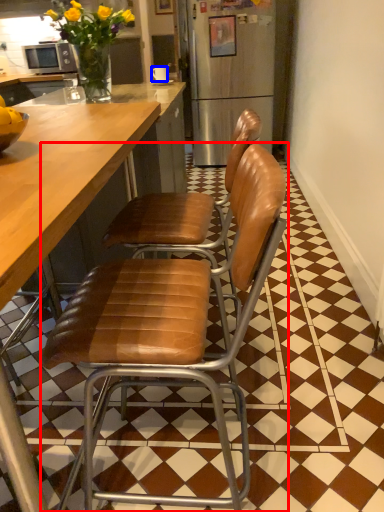
Question: Among these objects, which one is farthest to the camera, chair (highlighted by a red box) or coffee cup (highlighted by a blue box)?

Choices:
 (A) chair
 (B) coffee cup

Answer: (B)